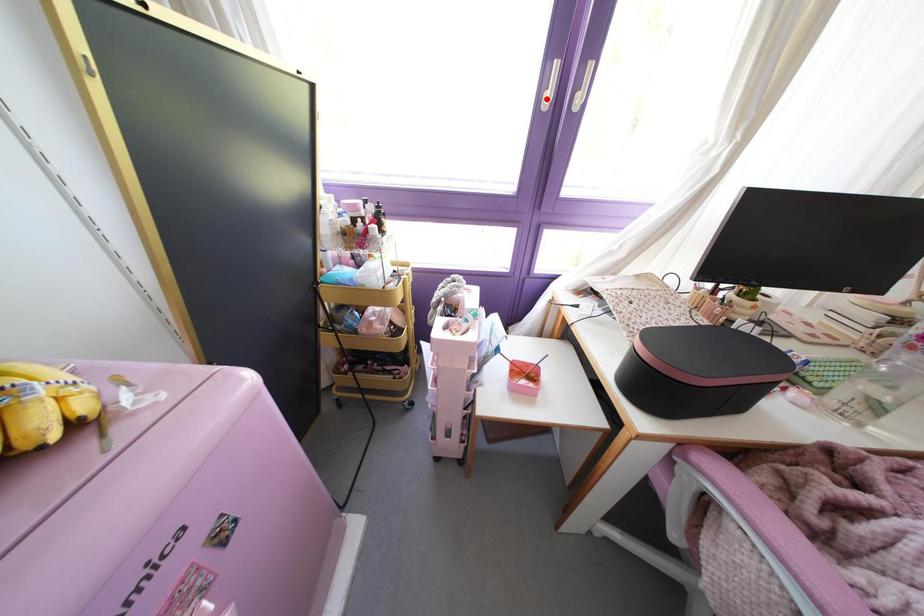
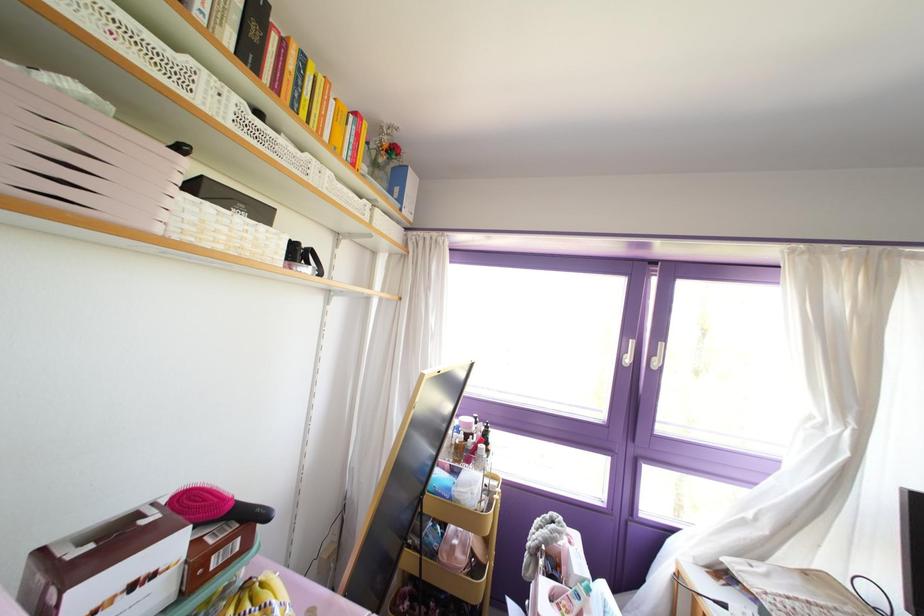
Where in the second image is the point corresponding to the highlighted location from the first image?

(626, 360)